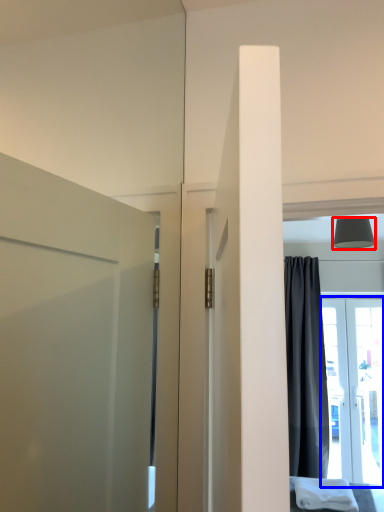
Question: Which object is further to the camera taking this photo, lamp (highlighted by a red box) or door (highlighted by a blue box)?

Choices:
 (A) lamp
 (B) door

Answer: (B)